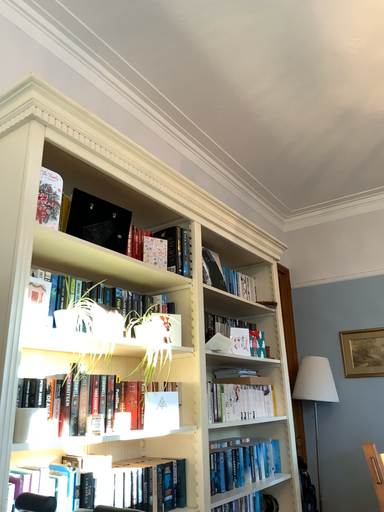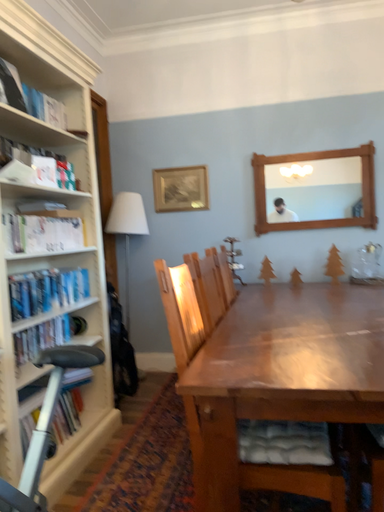
Question: Which way did the camera rotate in the video?

Choices:
 (A) rotated downward
 (B) rotated upward

Answer: (A)